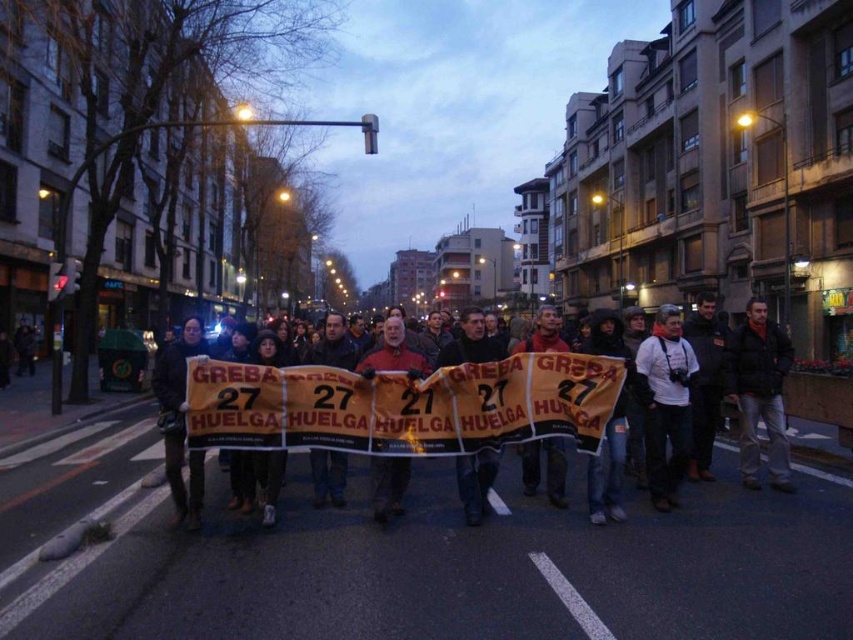
You are a journalist covering the protest. You see the orange fabric banner at center and the white fabric camera at center. Which object is closer to the left side of the image?

The orange fabric banner at center is closer to the left side of the image than the white fabric camera at center.

What are the coordinates of the orange fabric banner at center in the image?

The orange fabric banner at center is located at coordinates (419,406).